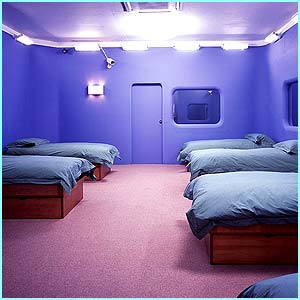
Identify the location of bed. (222, 199).